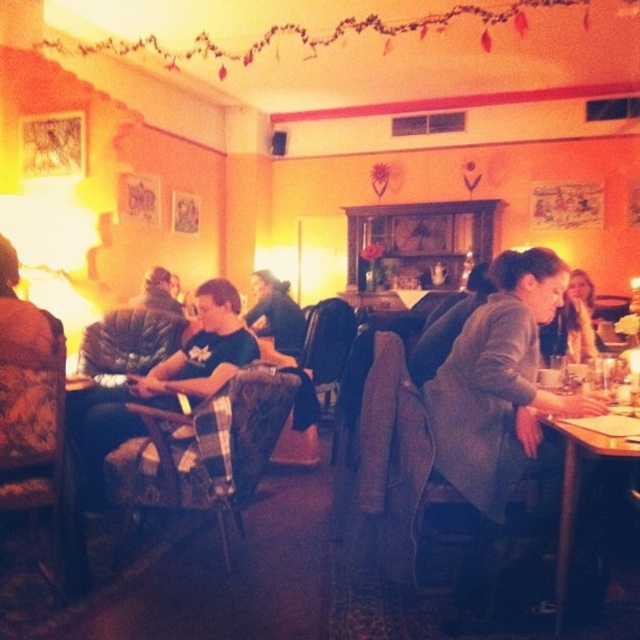
You are a customer entering the cozy, warmly lit interior space and want to place your dark brown leather jacket at center on a table. Which table should you choose between the wooden table at lower right and another table? Explain your choice based on the table size.

The wooden table at lower right is smaller than the dark brown leather jacket at center, so the jacket may not fit properly on it. Choose a larger table instead.

You are a customer entering the cozy, warmly lit interior space with a gray woolen coat at center and a dark brown leather jacket at center. You want to hang your coat on the nearest available hook. Which coat is closer to you so you can reach it first?

The gray woolen coat at center is closer to the viewer than the dark brown leather jacket at center, so you can reach it first.

You are a customer entering the cozy, warmly lit interior space and see both the gray woolen coat at center and the dark brown leather jacket at center hanging on a coat rack. Which one is taller?

The gray woolen coat at center is taller than the dark brown leather jacket at center.